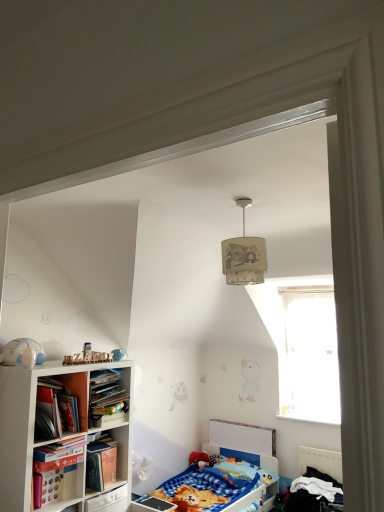
Identify the location of vacant space underneath transparent glass window at upper right (from a real-world perspective). (304, 413).